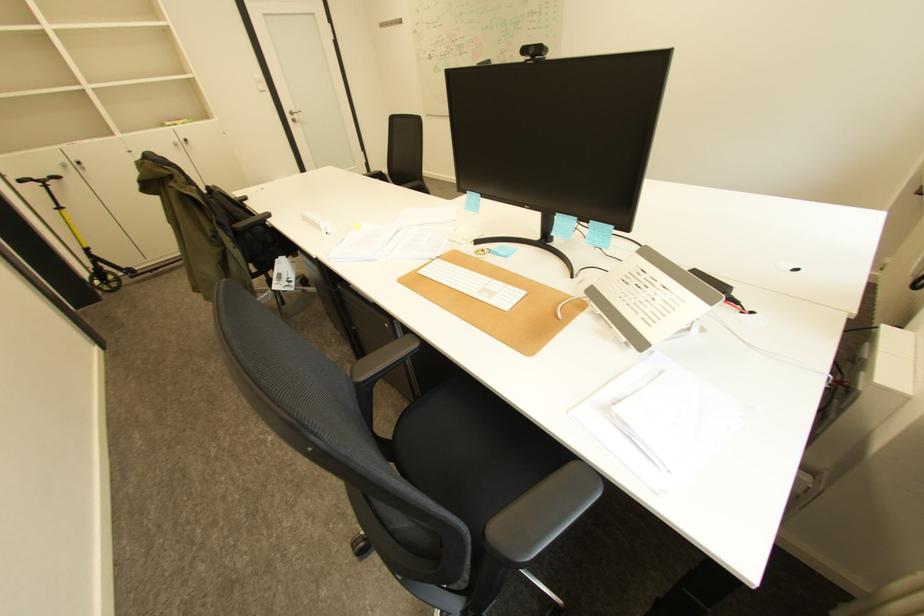
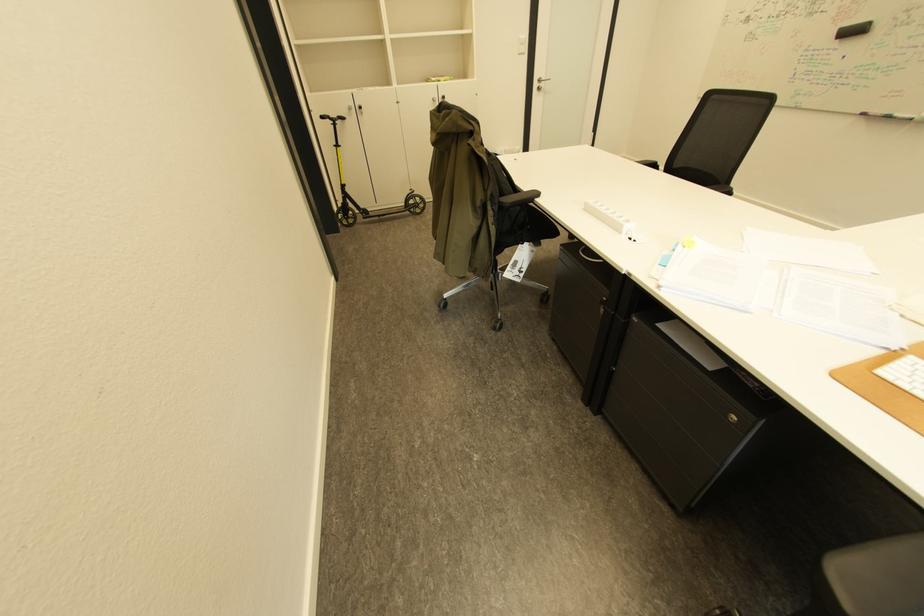
In a continuous first-person perspective shot, in which direction is the camera moving?

The cameraman walked toward left, forward.